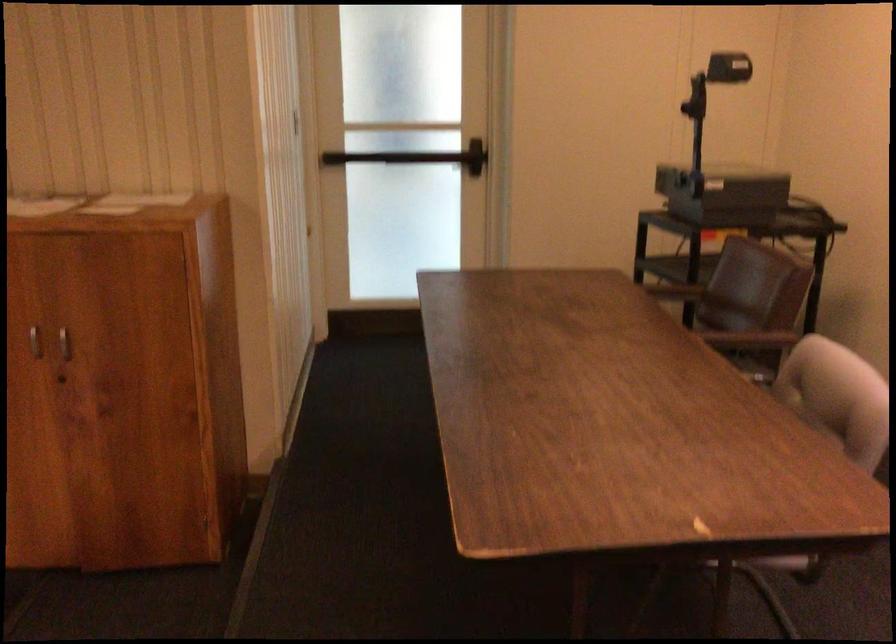
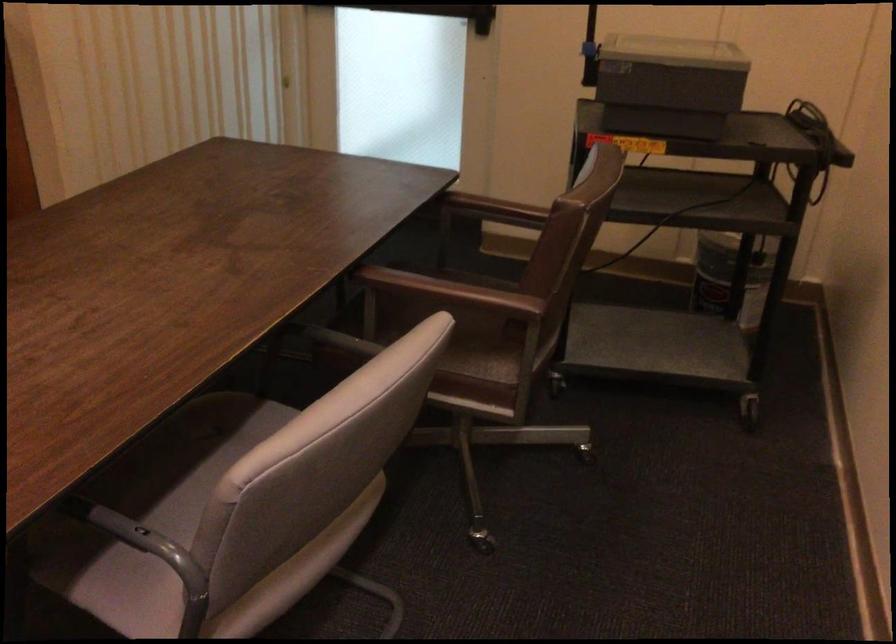
Locate, in the second image, the point that corresponds to (x=446, y=162) in the first image.

(437, 12)